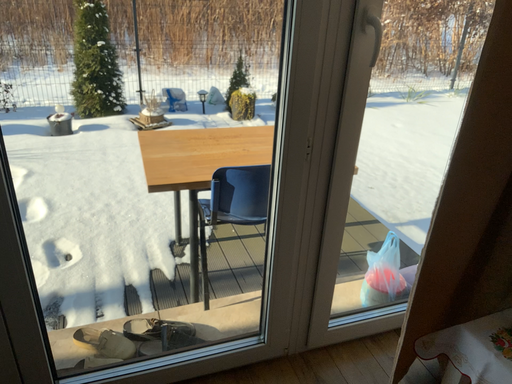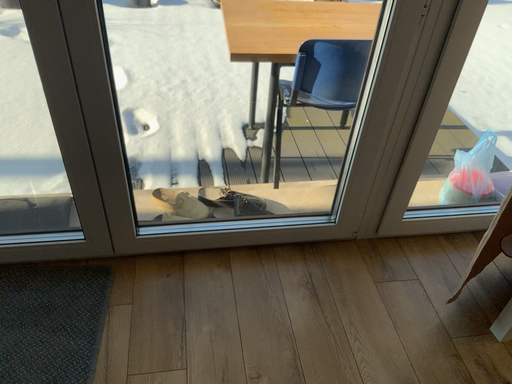
Question: Which way did the camera rotate in the video?

Choices:
 (A) rotated right
 (B) rotated left

Answer: (B)